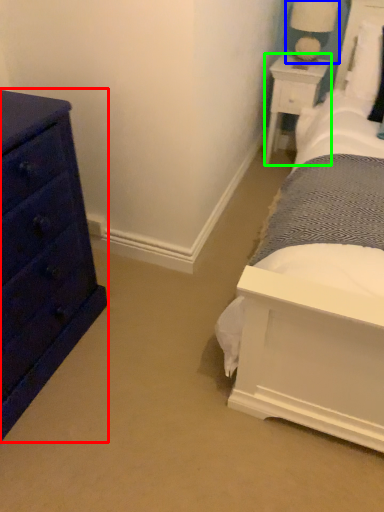
Question: Which is farther away from chest of drawers (highlighted by a red box)? table lamp (highlighted by a blue box) or nightstand (highlighted by a green box)?

Choices:
 (A) table lamp
 (B) nightstand

Answer: (A)